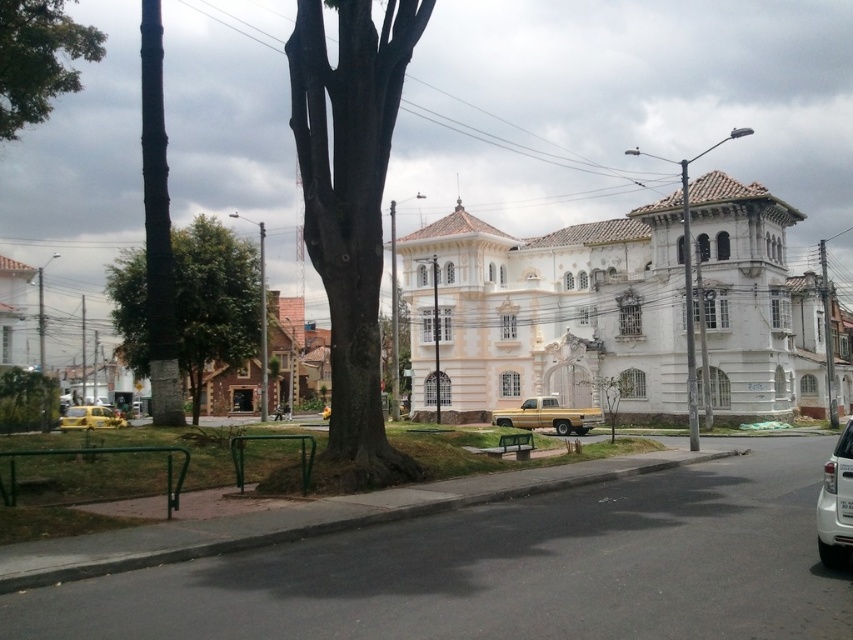
Between point (828, 492) and point (523, 406), which one is positioned in front?

Point (828, 492)

Is point (836, 497) positioned in front of point (573, 416)?

Yes, it is in front of point (573, 416).

Identify the location of white matte car at lower right. (836, 502).

Can you confirm if brown rough bark tree at center is bigger than yellow matte taxi at lower left?

Yes, brown rough bark tree at center is bigger than yellow matte taxi at lower left.

The height and width of the screenshot is (640, 853). What are the coordinates of `brown rough bark tree at center` in the screenshot? It's located at (350, 212).

You are a GUI agent. You are given a task and a screenshot of the screen. Output one action in this format:
    pyautogui.click(x=<x>, y=<y>)
    Task: Click on the brown rough bark tree at center
    Image resolution: width=853 pixels, height=640 pixels.
    Given the screenshot: What is the action you would take?
    [350, 212]

Between brown brick building at lower left and gold metallic pickup truck at center, which one appears on the right side from the viewer's perspective?

Positioned to the right is gold metallic pickup truck at center.

Who is lower down, brown brick building at lower left or gold metallic pickup truck at center?

gold metallic pickup truck at center is lower down.

Is point (328, 336) farther from camera compared to point (500, 420)?

Yes, it is.

What are the coordinates of `brown brick building at lower left` in the screenshot? It's located at (294, 353).